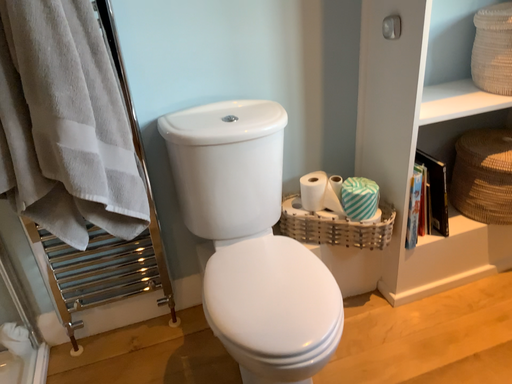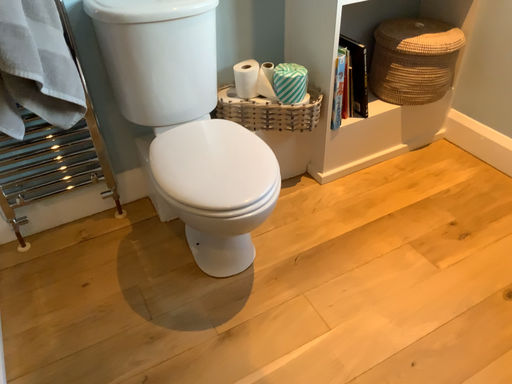
Question: Which way did the camera rotate in the video?

Choices:
 (A) rotated left
 (B) rotated right

Answer: (B)